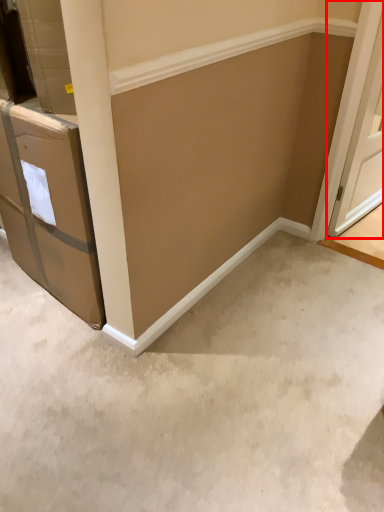
Question: In this image, where is door (annotated by the red box) located relative to concrete?

Choices:
 (A) right
 (B) left

Answer: (A)